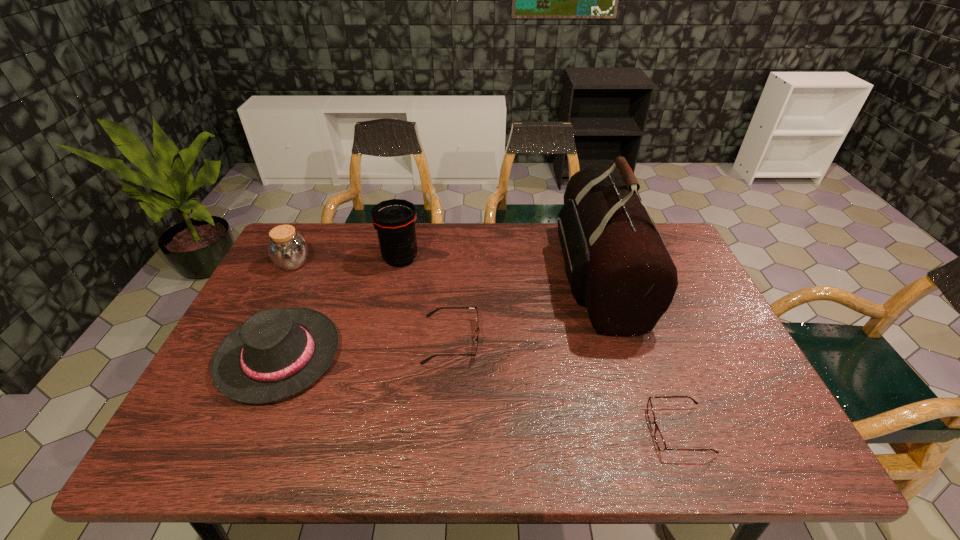
Where is `telephoto lens located at the far edge`? This screenshot has height=540, width=960. telephoto lens located at the far edge is located at coordinates (395, 219).

Where is `jar that is positioned at the far edge`? This screenshot has width=960, height=540. jar that is positioned at the far edge is located at coordinates (288, 250).

Identify the location of object situated at the near edge. (660, 442).

The width and height of the screenshot is (960, 540). Find the location of `jar that is at the left edge`. jar that is at the left edge is located at coordinates (288, 250).

Find the location of a particular element. The height and width of the screenshot is (540, 960). dress hat located at the left edge is located at coordinates (276, 353).

Where is `object located in the right edge section of the desktop`? This screenshot has width=960, height=540. object located in the right edge section of the desktop is located at coordinates point(660,442).

The image size is (960, 540). I want to click on object situated at the far left corner, so click(288, 250).

You are a GUI agent. You are given a task and a screenshot of the screen. Output one action in this format:
    pyautogui.click(x=<x>, y=<y>)
    Task: Click on the object located at the near right corner
    
    Given the screenshot: What is the action you would take?
    pyautogui.click(x=660, y=442)

In the image, there is a desktop. Where is `free space at the far edge`? free space at the far edge is located at coordinates (533, 237).

Image resolution: width=960 pixels, height=540 pixels. In the image, there is a desktop. What are the coordinates of `vacant space at the near edge` in the screenshot? It's located at (592, 460).